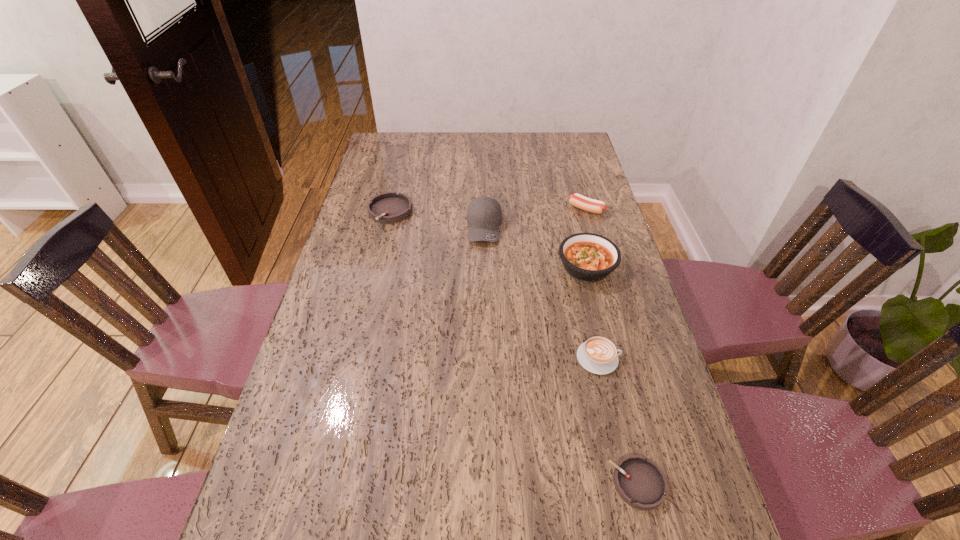
Locate an element on the screen. The image size is (960, 540). vacant space situated on the back of the left ashtray is located at coordinates (397, 181).

Image resolution: width=960 pixels, height=540 pixels. Identify the location of vacant space located on the left of the nearer ashtray. (487, 483).

Identify the location of free region located 0.400m on the front of the third nearest object. (623, 417).

At what (x,y) coordinates should I click in order to perform the action: click on vacant space situated 0.100m on the front brim of the tallest object. Please return your answer as a coordinate pair (x, y). The height and width of the screenshot is (540, 960). Looking at the image, I should click on pyautogui.click(x=485, y=268).

Identify the location of vacant space positioned 0.130m on the back of the sausage. This screenshot has height=540, width=960. (578, 181).

I want to click on free space located on the side of the fifth farthest object with the handle, so click(656, 358).

The image size is (960, 540). What are the coordinates of `object that is at the near edge` in the screenshot? It's located at (640, 482).

This screenshot has width=960, height=540. I want to click on object at the left edge, so click(x=389, y=207).

Find the location of a particular element. Image resolution: width=960 pixels, height=540 pixels. ashtray present at the right edge is located at coordinates (640, 482).

At what (x,y) coordinates should I click in order to perform the action: click on stew located in the right edge section of the desktop. Please return your answer as a coordinate pair (x, y). The height and width of the screenshot is (540, 960). Looking at the image, I should click on (588, 257).